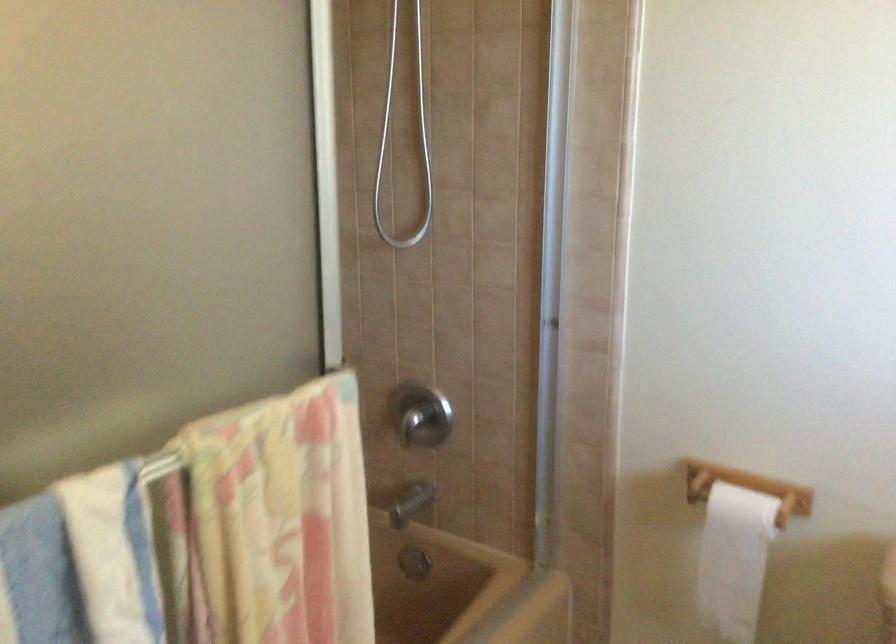
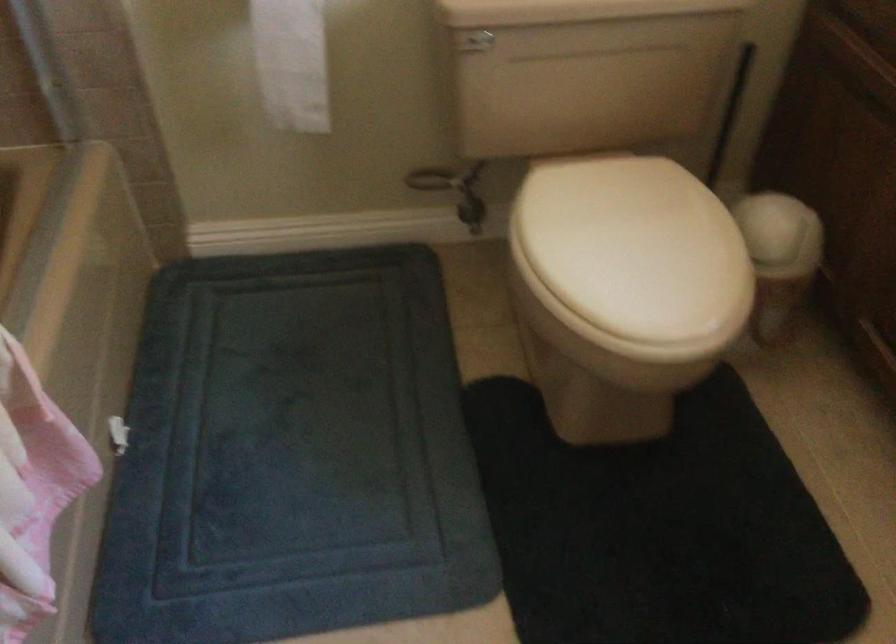
Where in the second image is the point corresponding to (735,571) from the first image?

(291, 62)